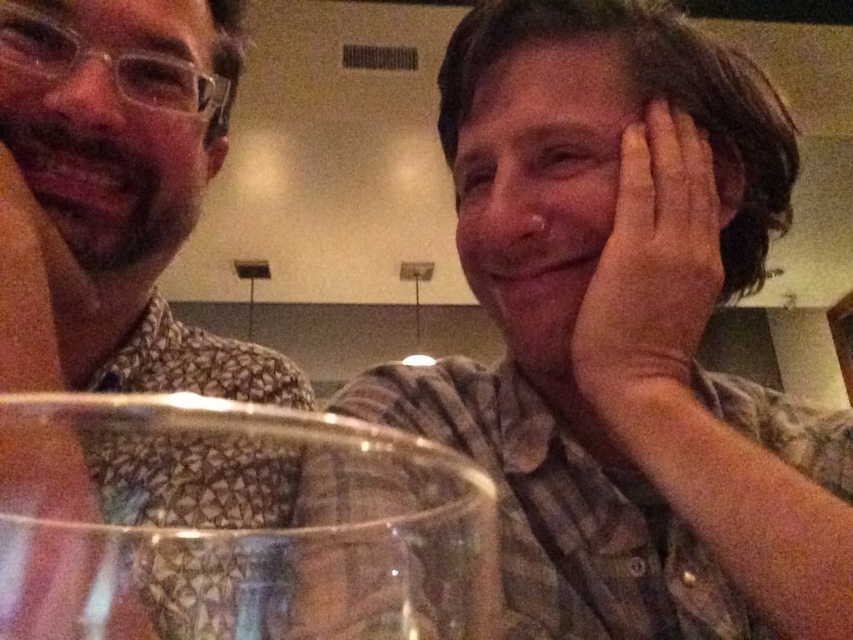
You are a photographer trying to capture a candid shot of the two people at the table. The glass in front of them is blocking your view. If you move the glass to the side, will you be able to see both the patterned shirt at left and the pink skin at right clearly in the same frame?

The distance between the patterned shirt at left and the pink skin at right is 10.90 inches, so moving the glass to the side should allow both to be seen clearly in the same frame since they are within a reasonable proximity.

You are a photographer trying to capture a clear shot of both the patterned shirt at left and the pink skin at right. Since there is a glass object in the way, you need to adjust your position. Which direction should you move to ensure both subjects are visible without the glass obstructing them?

You should move to the left side of the scene so that the glass object is no longer blocking the view of both the patterned shirt at left and the pink skin at right.